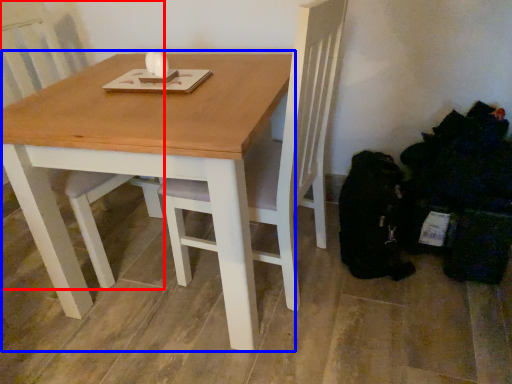
Question: Which object appears farthest to the camera in this image, chair (highlighted by a red box) or table (highlighted by a blue box)?

Choices:
 (A) chair
 (B) table

Answer: (A)